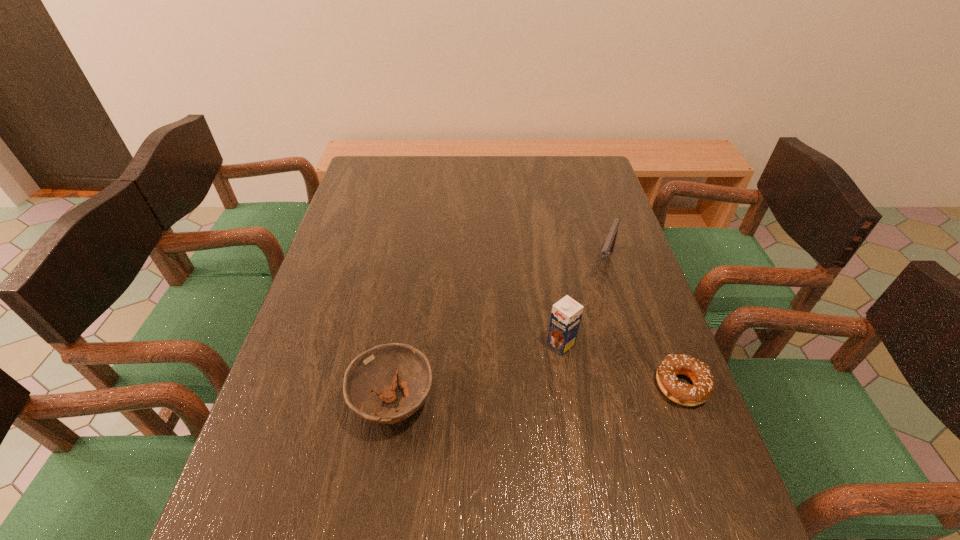
Where is `free space at the far left corner`? The image size is (960, 540). free space at the far left corner is located at coordinates (381, 172).

This screenshot has width=960, height=540. In the image, there is a desktop. Find the location of `free space at the far right corner`. free space at the far right corner is located at coordinates (609, 187).

Where is `free space between the chocolate milk and the shortest object`? This screenshot has width=960, height=540. free space between the chocolate milk and the shortest object is located at coordinates (621, 365).

The image size is (960, 540). Find the location of `empty location between the second object from left to right and the second shortest object`. empty location between the second object from left to right and the second shortest object is located at coordinates (477, 373).

The image size is (960, 540). I want to click on empty space between the shortest object and the third shortest object, so click(643, 324).

Where is `vacant space in between the tallest object and the pistol`? The height and width of the screenshot is (540, 960). vacant space in between the tallest object and the pistol is located at coordinates (583, 303).

At what (x,y) coordinates should I click in order to perform the action: click on vacant space in between the second tallest object and the third tallest object. Please return your answer as a coordinate pair (x, y). The height and width of the screenshot is (540, 960). Looking at the image, I should click on (499, 332).

At what (x,y) coordinates should I click in order to perform the action: click on free space between the third tallest object and the shortest object. Please return your answer as a coordinate pair (x, y). Looking at the image, I should click on (538, 394).

Find the location of `vacant space that's between the shortest object and the chocolate milk`. vacant space that's between the shortest object and the chocolate milk is located at coordinates (621, 365).

Identify the location of vacant area that lies between the bowl and the shortest object. The width and height of the screenshot is (960, 540). (538, 394).